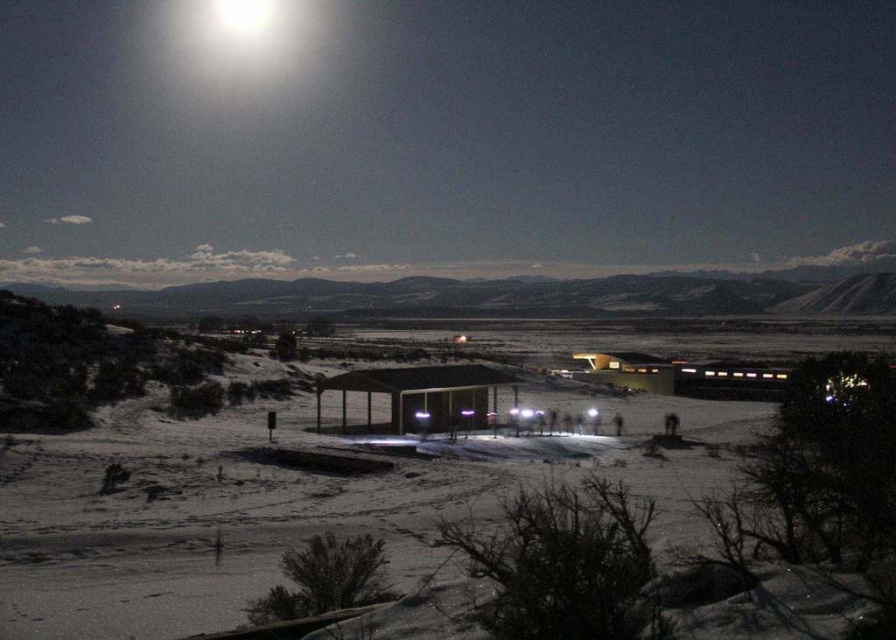
You are standing in the snowy landscape and want to take a photo of the matte wood hut at center and the bright white light at upper center. Which object will appear larger in the photo?

The matte wood hut at center will appear larger in the photo because it is closer to the camera than the bright white light at upper center.